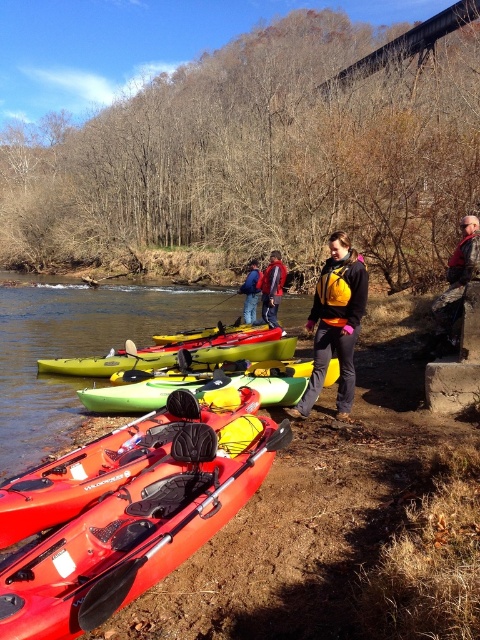
Question: Is camouflage fabric jacket at right to the right of blue denim jacket at center from the viewer's perspective?

Choices:
 (A) yes
 (B) no

Answer: (A)

Question: Is matte red kayak at lower left smaller than black rubber paddle at lower left?

Choices:
 (A) no
 (B) yes

Answer: (A)

Question: Based on their relative distances, which object is nearer to the matte red kayak at lower left?

Choices:
 (A) matte blue jacket at center
 (B) camouflage fabric jacket at right
 (C) matte green kayak at center
 (D) green matte kayak at center

Answer: (D)

Question: Does yellow rubber paddle at center appear on the left side of blue denim jacket at center?

Choices:
 (A) yes
 (B) no

Answer: (A)

Question: Estimate the real-world distances between objects in this image. Which object is closer to the matte green kayak at center?

Choices:
 (A) yellow life vest at center
 (B) matte blue jacket at center
 (C) green matte kayak at center
 (D) blue denim jacket at center

Answer: (C)

Question: Which point is farther to the camera?

Choices:
 (A) (193, 381)
 (B) (260, 285)
 (C) (252, 260)

Answer: (C)